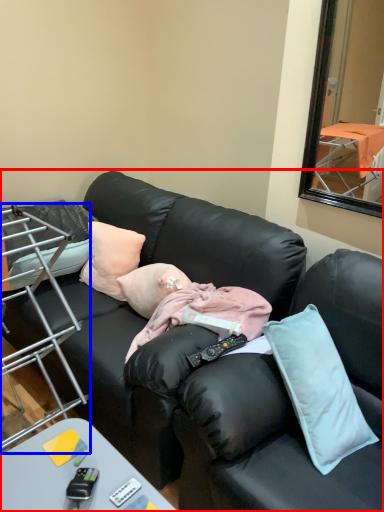
Question: Which object appears closest to the camera in this image, studio couch (highlighted by a red box) or chair (highlighted by a blue box)?

Choices:
 (A) studio couch
 (B) chair

Answer: (B)